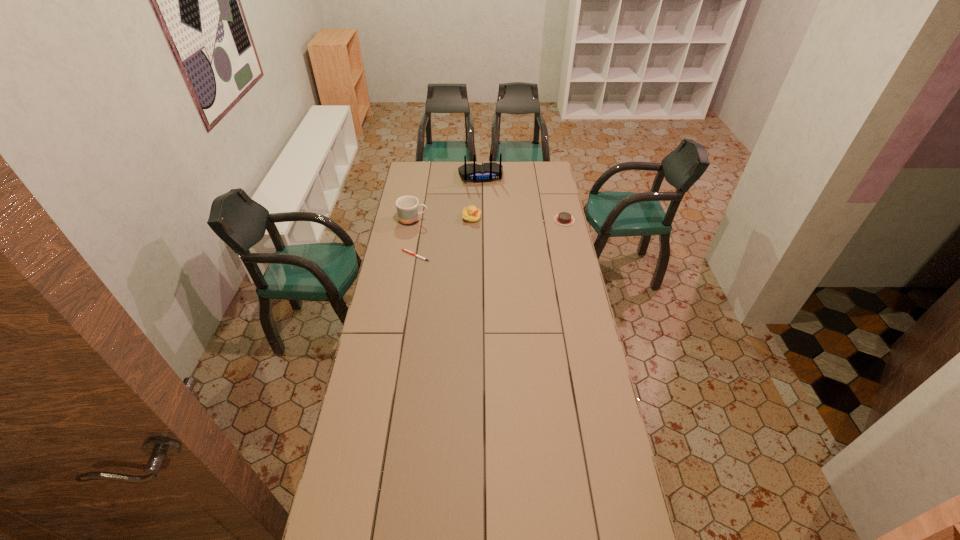
The image size is (960, 540). Identify the location of free spot on the desktop that is between the nearest object and the second shortest object and is positioned at the face of the duckling. (512, 233).

Locate an element on the screen. Image resolution: width=960 pixels, height=540 pixels. vacant space on the desktop that is between the shortest object and the rightmost object and is positioned on the side with the handle of the second tallest object is located at coordinates (514, 232).

Identify the location of vacant space on the desktop that is between the shortest object and the fourth tallest object and is positioned on the back of the farthest object. (492, 237).